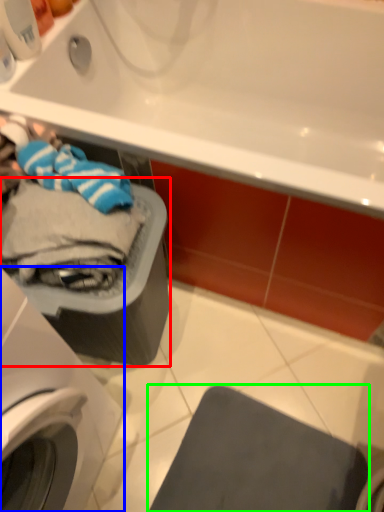
Question: Based on their relative distances, which object is nearer to dish washer (highlighted by a red box)? Choose from washing machine (highlighted by a blue box) and gray (highlighted by a green box).

Choices:
 (A) washing machine
 (B) gray

Answer: (A)